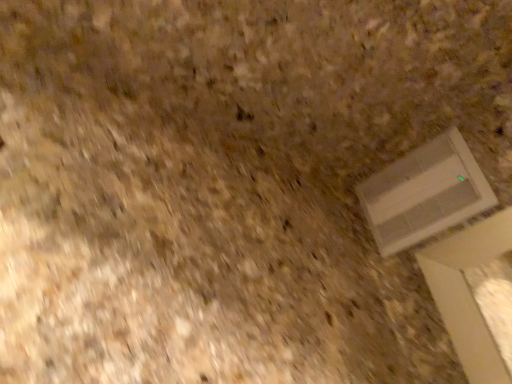
The image size is (512, 384). What do you see at coordinates (424, 193) in the screenshot? I see `white plastic window at lower right` at bounding box center [424, 193].

You are a GUI agent. You are given a task and a screenshot of the screen. Output one action in this format:
    pyautogui.click(x=<x>, y=<y>)
    Task: Click on the white plastic window at lower right
    
    Given the screenshot: What is the action you would take?
    pyautogui.click(x=424, y=193)

Locate an element on the screen. This screenshot has height=384, width=512. white plastic window at lower right is located at coordinates (424, 193).